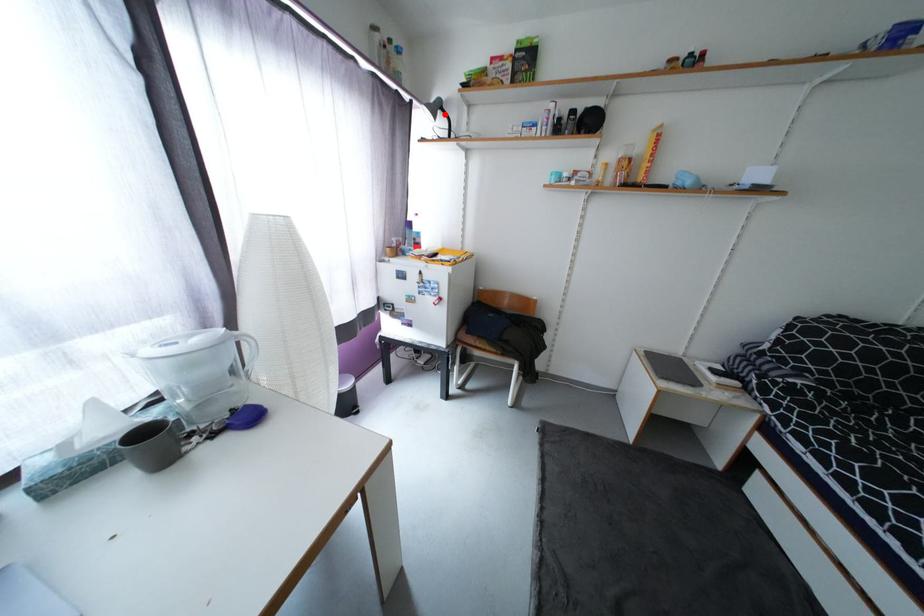
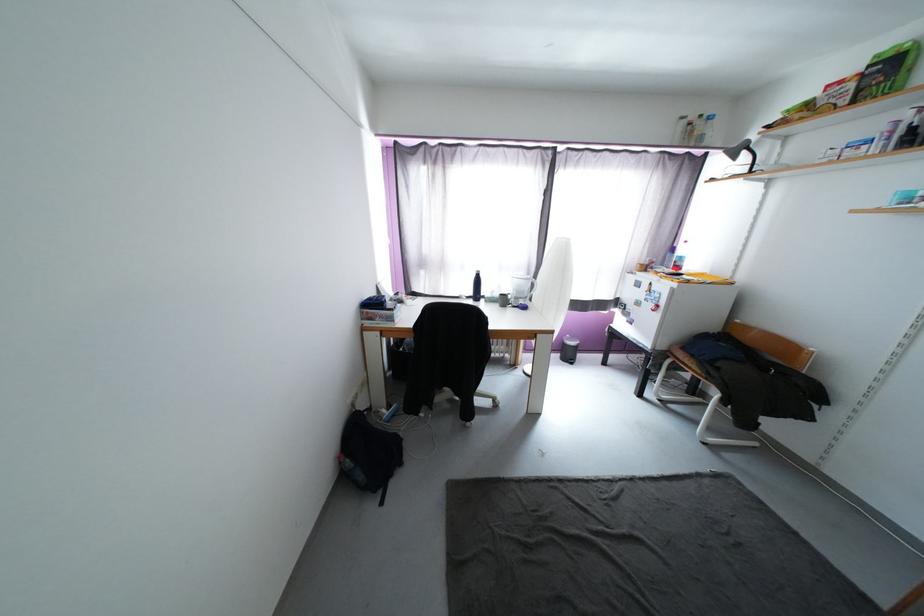
Locate, in the second image, the point that corresponds to the highlighted location in the first image.

(749, 154)